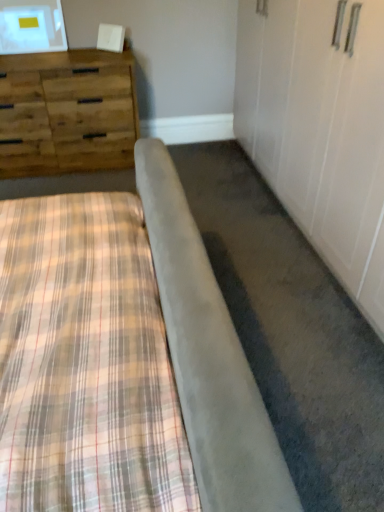
Question: Considering the relative sizes of plaid fabric bed at lower left and woodenmaterial/texturechest of drawers at upper left in the image provided, is plaid fabric bed at lower left wider than woodenmaterial/texturechest of drawers at upper left?

Choices:
 (A) yes
 (B) no

Answer: (A)

Question: From a real-world perspective, is plaid fabric bed at lower left positioned over woodenmaterial/texturechest of drawers at upper left based on gravity?

Choices:
 (A) yes
 (B) no

Answer: (B)

Question: Does plaid fabric bed at lower left have a lesser width compared to woodenmaterial/texturechest of drawers at upper left?

Choices:
 (A) yes
 (B) no

Answer: (B)

Question: Considering the relative sizes of plaid fabric bed at lower left and woodenmaterial/texturechest of drawers at upper left in the image provided, is plaid fabric bed at lower left smaller than woodenmaterial/texturechest of drawers at upper left?

Choices:
 (A) yes
 (B) no

Answer: (B)

Question: Considering the relative positions of plaid fabric bed at lower left and woodenmaterial/texturechest of drawers at upper left in the image provided, is plaid fabric bed at lower left in front of woodenmaterial/texturechest of drawers at upper left?

Choices:
 (A) no
 (B) yes

Answer: (B)

Question: Is plaid fabric bed at lower left taller than woodenmaterial/texturechest of drawers at upper left?

Choices:
 (A) yes
 (B) no

Answer: (B)

Question: From a real-world perspective, does woodenmaterial/texturechest of drawers at upper left stand above plaid fabric bed at lower left?

Choices:
 (A) no
 (B) yes

Answer: (B)

Question: Is woodenmaterial/texturechest of drawers at upper left positioned beyond the bounds of plaid fabric bed at lower left?

Choices:
 (A) no
 (B) yes

Answer: (B)

Question: From a real-world perspective, is woodenmaterial/texturechest of drawers at upper left below plaid fabric bed at lower left?

Choices:
 (A) yes
 (B) no

Answer: (B)

Question: Is woodenmaterial/texturechest of drawers at upper left to the left of plaid fabric bed at lower left from the viewer's perspective?

Choices:
 (A) yes
 (B) no

Answer: (A)

Question: Considering the relative sizes of woodenmaterial/texturechest of drawers at upper left and plaid fabric bed at lower left in the image provided, is woodenmaterial/texturechest of drawers at upper left shorter than plaid fabric bed at lower left?

Choices:
 (A) no
 (B) yes

Answer: (A)

Question: From the image's perspective, is woodenmaterial/texturechest of drawers at upper left located beneath plaid fabric bed at lower left?

Choices:
 (A) no
 (B) yes

Answer: (A)

Question: Looking at their shapes, would you say woodenmaterial/texturechest of drawers at upper left is wider or thinner than plaid fabric bed at lower left?

Choices:
 (A) thin
 (B) wide

Answer: (A)